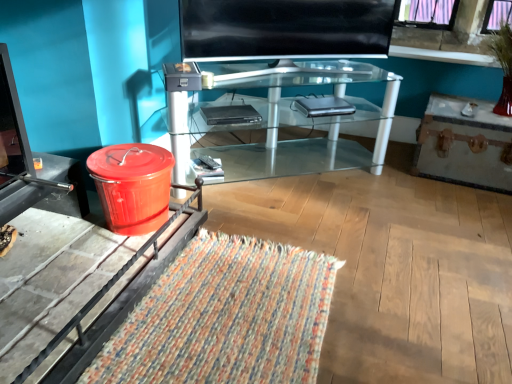
Question: Considering the relative sizes of shiny plastic trash can at lower left and silver metallic laptop at center, the 2th laptop when ordered from left to right, in the image provided, is shiny plastic trash can at lower left bigger than silver metallic laptop at center, the 2th laptop when ordered from left to right,?

Choices:
 (A) no
 (B) yes

Answer: (B)

Question: Are shiny plastic trash can at lower left and silver metallic laptop at center, positioned as the 1th laptop in right-to-left order, located far from each other?

Choices:
 (A) no
 (B) yes

Answer: (B)

Question: Does shiny plastic trash can at lower left have a greater width compared to silver metallic laptop at center, positioned as the 1th laptop in right-to-left order?

Choices:
 (A) yes
 (B) no

Answer: (A)

Question: Could you tell me if shiny plastic trash can at lower left is turned towards silver metallic laptop at center, the 2th laptop when ordered from left to right?

Choices:
 (A) no
 (B) yes

Answer: (A)

Question: Does shiny plastic trash can at lower left come behind silver metallic laptop at center, arranged as the 1th laptop when viewed from the back?

Choices:
 (A) no
 (B) yes

Answer: (A)

Question: In terms of size, does woven multicolored mat at lower left appear bigger or smaller than metallic silver drawer at right?

Choices:
 (A) big
 (B) small

Answer: (B)

Question: Would you say woven multicolored mat at lower left is inside or outside metallic silver drawer at right?

Choices:
 (A) inside
 (B) outside

Answer: (B)

Question: Is point (166, 278) positioned closer to the camera than point (468, 135)?

Choices:
 (A) farther
 (B) closer

Answer: (B)

Question: Would you say woven multicolored mat at lower left is to the left or to the right of metallic silver drawer at right in the picture?

Choices:
 (A) left
 (B) right

Answer: (A)

Question: From a real-world perspective, is black glass screen at center positioned above or below woven multicolored mat at lower left?

Choices:
 (A) below
 (B) above

Answer: (B)

Question: From the image's perspective, is black glass screen at center located above or below woven multicolored mat at lower left?

Choices:
 (A) below
 (B) above

Answer: (B)

Question: Considering the relative positions of black glass screen at center and woven multicolored mat at lower left in the image provided, is black glass screen at center to the left or to the right of woven multicolored mat at lower left?

Choices:
 (A) left
 (B) right

Answer: (B)

Question: Looking at the image, does black glass screen at center seem bigger or smaller compared to woven multicolored mat at lower left?

Choices:
 (A) small
 (B) big

Answer: (B)

Question: Is clear glass desk at center in front of or behind black plastic dvd player at center, positioned as the second laptop in right-to-left order, in the image?

Choices:
 (A) front
 (B) behind

Answer: (A)

Question: Do you think clear glass desk at center is within black plastic dvd player at center, which is the second laptop in back-to-front order, or outside of it?

Choices:
 (A) outside
 (B) inside

Answer: (A)